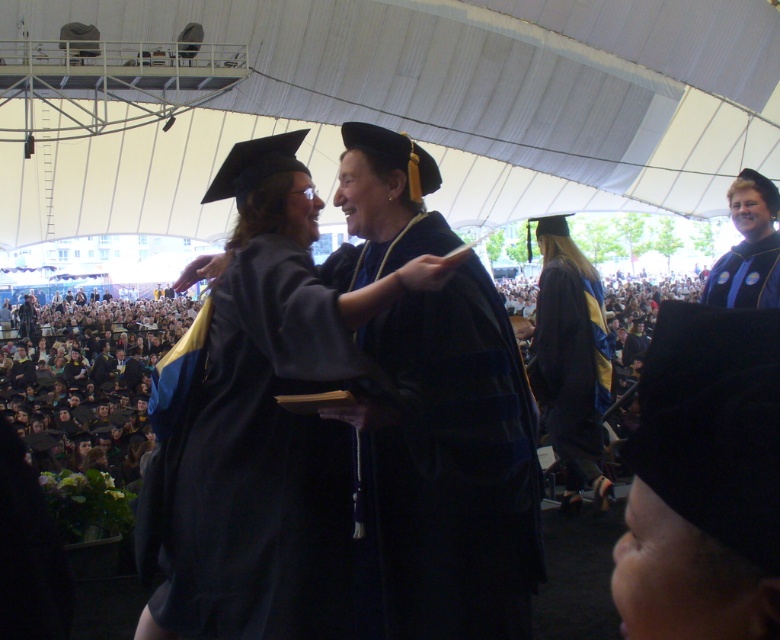
You are a photographer at the graduation ceremony. You need to adjust your camera focus to capture both the matte black graduation gown at center and the matte black graduation gown at upper right clearly. Since both are in the same scene, will you need to adjust the focus differently for each gown?

The matte black graduation gown at center is larger in size than the matte black graduation gown at upper right. This difference in size suggests that the gown at center is closer to the camera, so you will need to adjust the focus for each gown separately to ensure both are sharp.

You are a photographer at the graduation ceremony. You need to capture a photo where both the black matte graduation cap at lower right and the matte black graduation gown at upper right are clearly visible. Based on their positions, which object should you ensure is in the foreground to avoid being blocked by the other?

The black matte graduation cap at lower right should be in the foreground because it is below the matte black graduation gown at upper right, so placing it closer to the camera will prevent it from being obscured by the gown above.